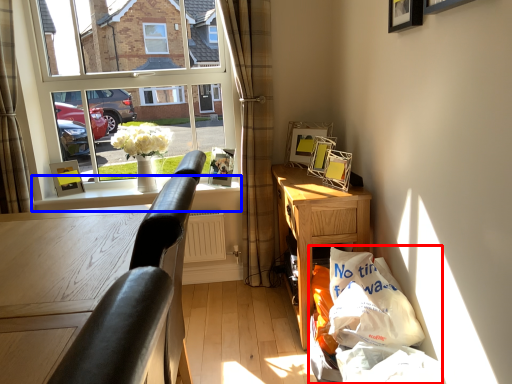
Question: Among these objects, which one is farthest to the camera, shopping bag (highlighted by a red box) or window sill (highlighted by a blue box)?

Choices:
 (A) shopping bag
 (B) window sill

Answer: (B)